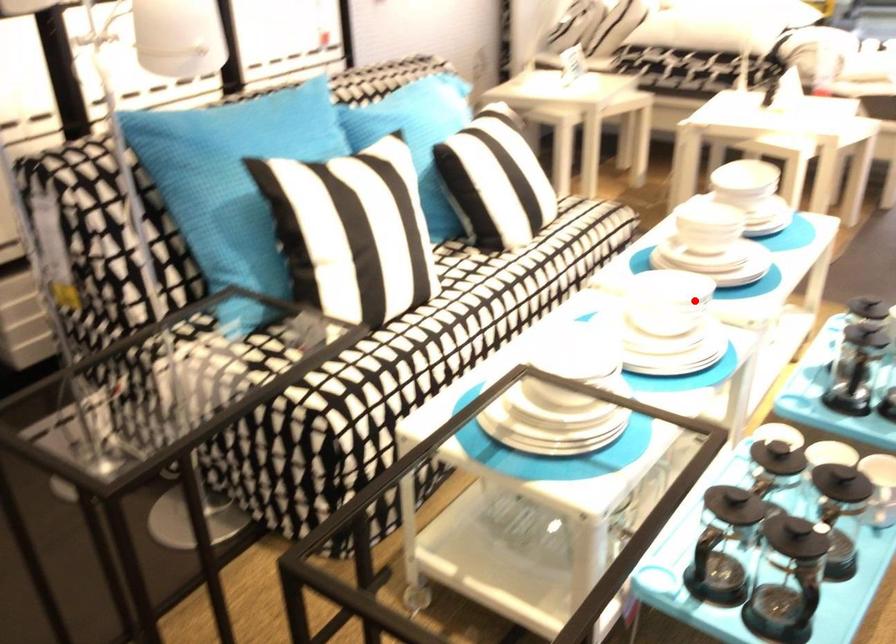
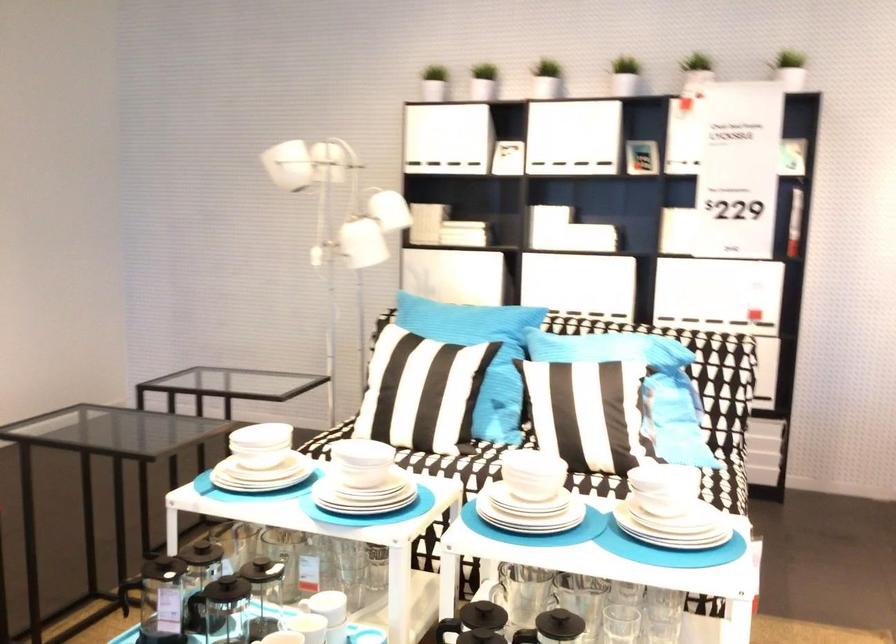
Where in the second image is the point corresponding to the highlighted location from the first image?

(360, 464)